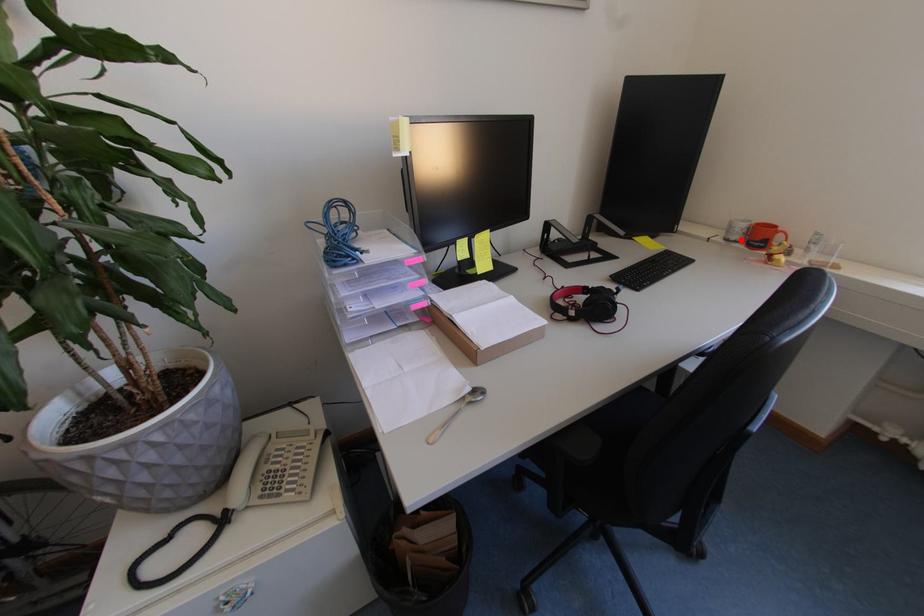
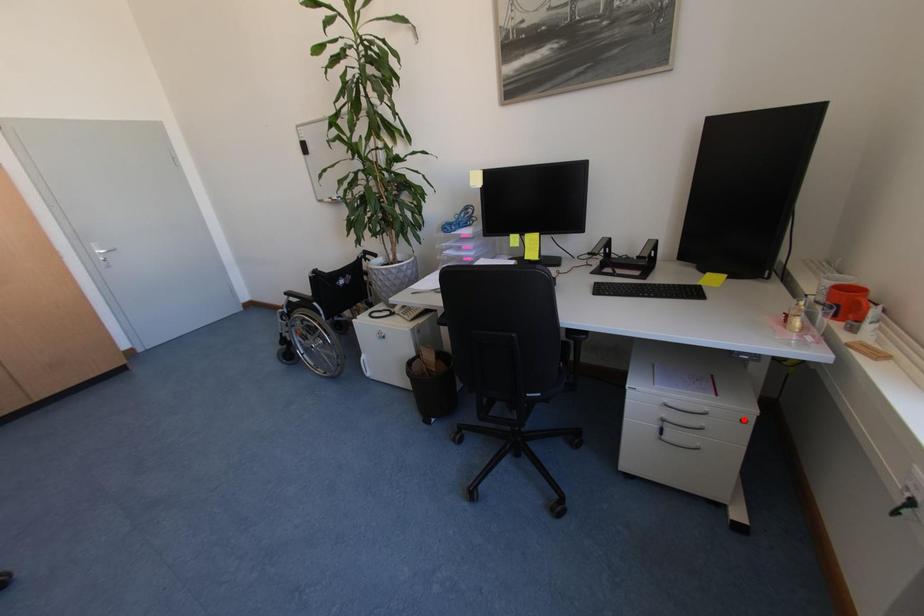
I am providing you with two images of the same scene from different viewpoints. A red point is marked on the first image and another point is marked on the second image. Does the point marked in image1 correspond to the same location as the one in image2?

No